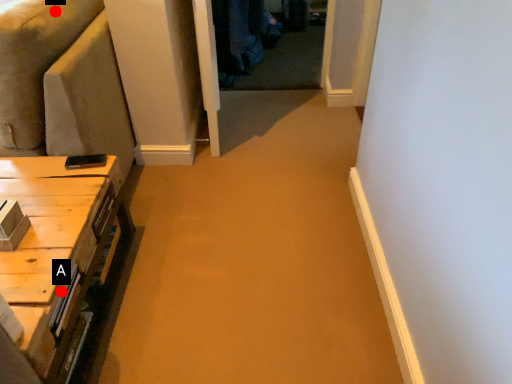
Question: Two points are circled on the image, labeled by A and B beside each circle. Which of the following is the closest to the observer?

Choices:
 (A) A is closer
 (B) B is closer

Answer: (A)